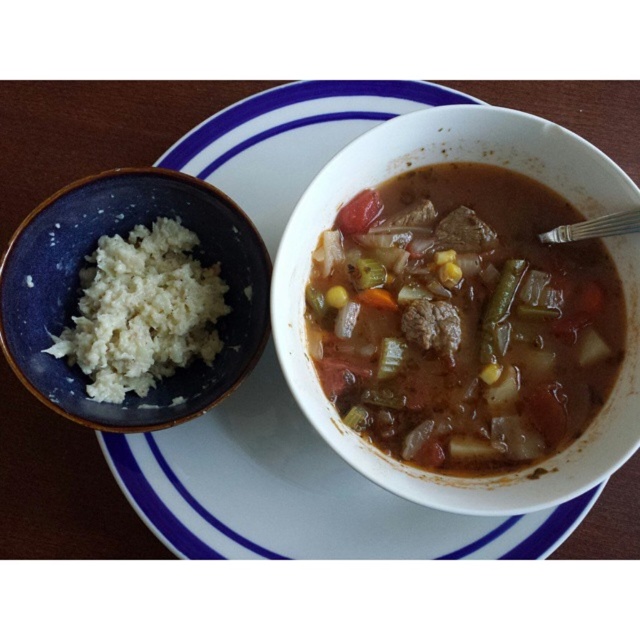
You are setting up a table for a dinner party and have a decorative centerpiece that is 10 cm wide. You want to place it between the blue matte bowl at left and the green translucent celery at center. Based on their sizes, will the space between them accommodate the centerpiece?

The blue matte bowl at left is wider than the green translucent celery at center. Since the space between them must be at least 10 cm to fit the centerpiece, but we donot know the exact distance between them, so it is uncertain whether the space is sufficient.

You are standing at the origin point of the table. The white glossy plate at center is located at point (298, 492). If you want to move towards the white glossy plate at center, which direction should you move in?

Since the white glossy plate at center is located at point (298, 492), you should move towards the coordinates (298, 492) to reach it.

You are setting up a dinner table and have a small salad plate that can only accommodate items smaller than the green leafy vegetable at center. Can the white glossy plate at center fit on the salad plate?

The white glossy plate at center is larger than the green leafy vegetable at center, so it cannot fit on the salad plate designed for items smaller than the green leafy vegetable at center.